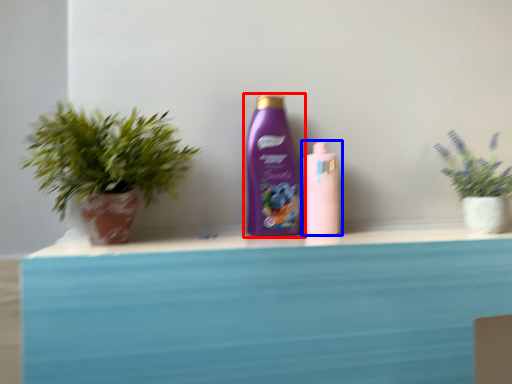
Question: Which point is further to the camera, bottle (highlighted by a red box) or bottle (highlighted by a blue box)?

Choices:
 (A) bottle
 (B) bottle

Answer: (B)